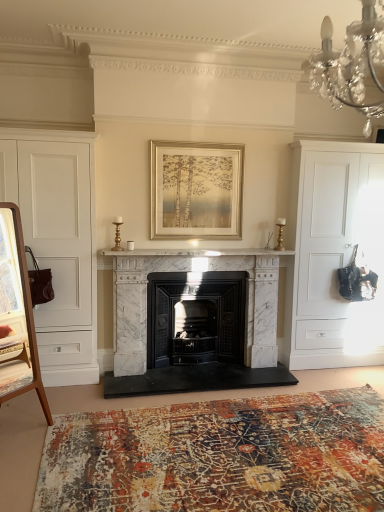
Question: Is white marble fireplace at center not close to white matte cabinet at left, which ranks as the second cabinetry in right-to-left order?

Choices:
 (A) no
 (B) yes

Answer: (A)

Question: Is white matte cabinet at left, the first cabinetry when ordered from left to right, inside white marble fireplace at center?

Choices:
 (A) yes
 (B) no

Answer: (B)

Question: From the image's perspective, is white marble fireplace at center beneath white matte cabinet at left, which ranks as the second cabinetry in right-to-left order?

Choices:
 (A) no
 (B) yes

Answer: (A)

Question: From a real-world perspective, is white marble fireplace at center physically above white matte cabinet at left, which ranks as the second cabinetry in right-to-left order?

Choices:
 (A) yes
 (B) no

Answer: (A)

Question: Does white marble fireplace at center lie in front of white matte cabinet at left, which ranks as the second cabinetry in right-to-left order?

Choices:
 (A) yes
 (B) no

Answer: (B)

Question: Is white marble fireplace at center directly adjacent to white matte cabinet at left, the first cabinetry when ordered from left to right?

Choices:
 (A) no
 (B) yes

Answer: (A)

Question: Would you say white matte cabinet at right, which is counted as the 1th cabinetry, starting from the right, is part of gold metallic picture frame at center's contents?

Choices:
 (A) no
 (B) yes

Answer: (A)

Question: Considering the relative positions of gold metallic picture frame at center and white matte cabinet at right, which is counted as the 1th cabinetry, starting from the right, in the image provided, is gold metallic picture frame at center to the left of white matte cabinet at right, which is counted as the 1th cabinetry, starting from the right, from the viewer's perspective?

Choices:
 (A) yes
 (B) no

Answer: (A)

Question: From the image's perspective, is gold metallic picture frame at center located above white matte cabinet at right, which is counted as the 1th cabinetry, starting from the right?

Choices:
 (A) yes
 (B) no

Answer: (A)

Question: Is gold metallic picture frame at center oriented towards white matte cabinet at right, which is counted as the 1th cabinetry, starting from the right?

Choices:
 (A) no
 (B) yes

Answer: (A)

Question: Is gold metallic picture frame at center shorter than white matte cabinet at right, which is counted as the 1th cabinetry, starting from the right?

Choices:
 (A) yes
 (B) no

Answer: (A)

Question: Does gold metallic picture frame at center lie behind white matte cabinet at right, which is counted as the 1th cabinetry, starting from the right?

Choices:
 (A) yes
 (B) no

Answer: (B)

Question: Considering the relative positions of white matte cabinet at right, the second cabinetry when ordered from left to right, and gold metallic picture frame at center in the image provided, is white matte cabinet at right, the second cabinetry when ordered from left to right, behind gold metallic picture frame at center?

Choices:
 (A) yes
 (B) no

Answer: (A)